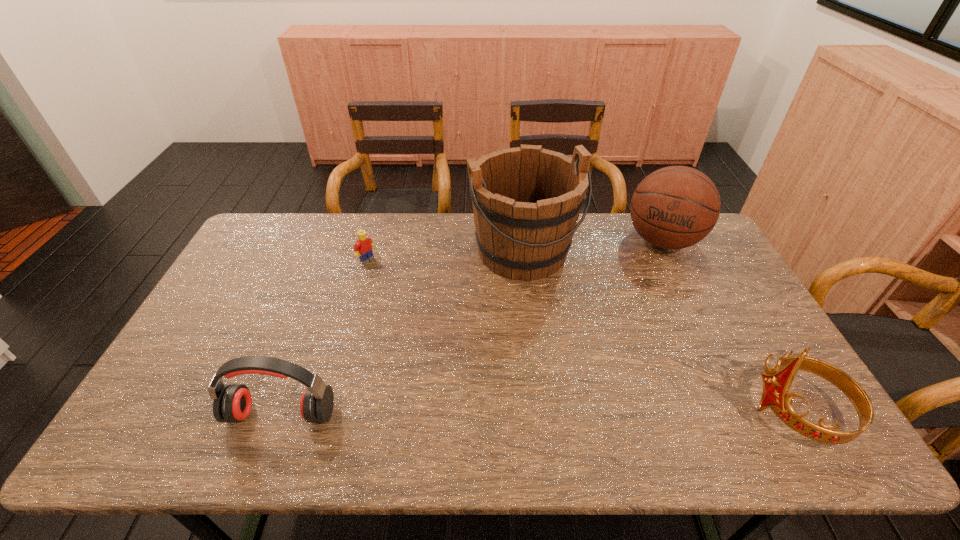
This screenshot has width=960, height=540. I want to click on the fourth tallest object, so click(232, 403).

Find the location of a particular element. Image resolution: width=960 pixels, height=540 pixels. tiara is located at coordinates (776, 386).

Where is `Lego`? Lego is located at coordinates (363, 247).

Where is `the tallest object`? The width and height of the screenshot is (960, 540). the tallest object is located at coordinates (526, 200).

This screenshot has height=540, width=960. In order to click on wine bucket in this screenshot , I will do [x=526, y=200].

The width and height of the screenshot is (960, 540). Find the location of `basketball`. basketball is located at coordinates click(x=675, y=207).

The height and width of the screenshot is (540, 960). Identify the location of blank area located on the front-facing side of the tiara. (660, 411).

At what (x,y) coordinates should I click in order to perform the action: click on vacant space located 0.100m on the front-facing side of the tiara. Please return your answer as a coordinate pair (x, y). The width and height of the screenshot is (960, 540). Looking at the image, I should click on (709, 411).

Identify the location of vacant point located 0.170m on the front-facing side of the tiara. This screenshot has width=960, height=540. (681, 411).

I want to click on vacant point located 0.140m on the front-facing side of the Lego, so click(x=400, y=284).